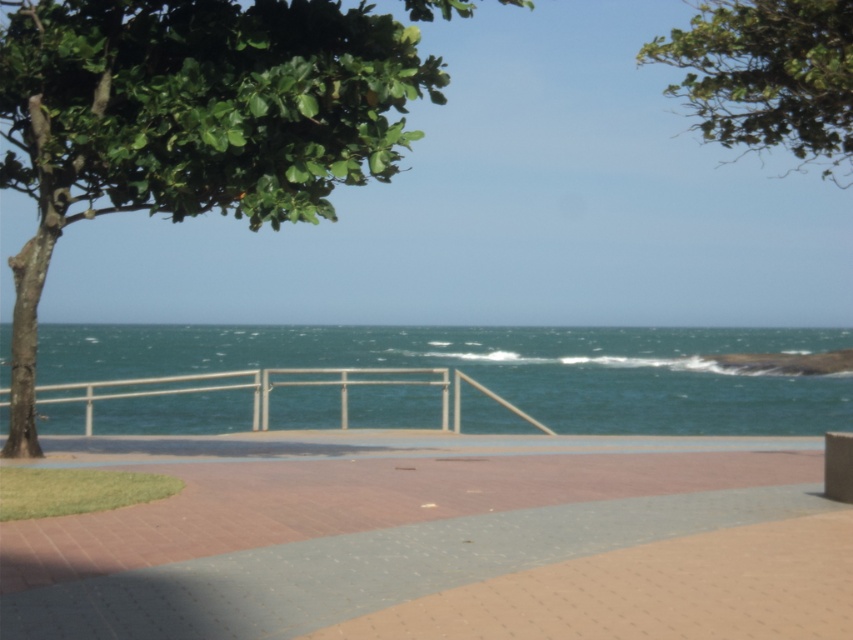
Question: Which is nearer to the green leafy tree at upper center?

Choices:
 (A) white metal rail at center
 (B) green leafy tree at upper left
 (C) brick paved path at center

Answer: (B)

Question: Can you confirm if brick paved path at center is positioned above white metal rail at center?

Choices:
 (A) yes
 (B) no

Answer: (A)

Question: Can you confirm if brick paved path at center is positioned above green leafy tree at upper left?

Choices:
 (A) no
 (B) yes

Answer: (A)

Question: Which point appears closest to the camera in this image?

Choices:
 (A) (442, 388)
 (B) (734, 508)

Answer: (B)

Question: Is brick paved path at center wider than white metal rail at center?

Choices:
 (A) yes
 (B) no

Answer: (B)

Question: Which point is closer to the camera taking this photo?

Choices:
 (A) (314, 342)
 (B) (747, 545)
 (C) (370, 384)
 (D) (747, 92)

Answer: (B)